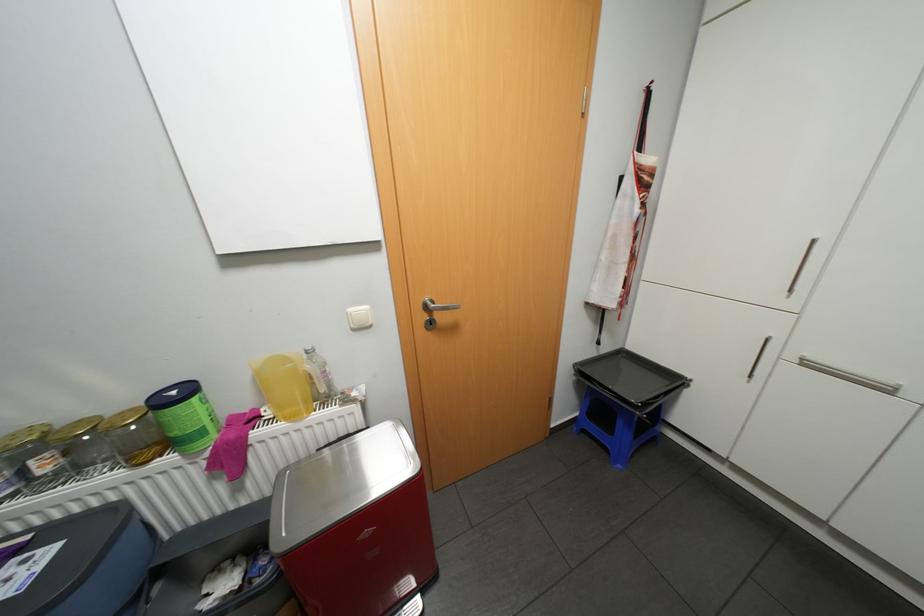
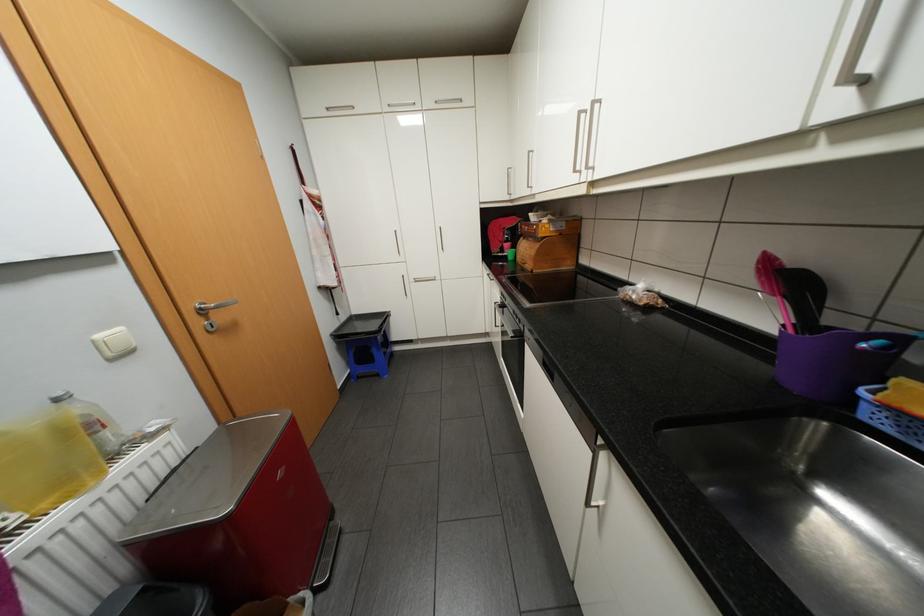
In the second image, find the point that corresponds to the point at 358,309 in the first image.

(106, 334)